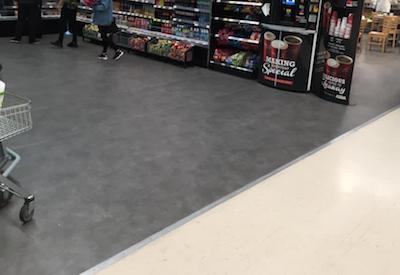
Locate an element on the screen. This screenshot has height=275, width=400. shelf is located at coordinates (236, 40).